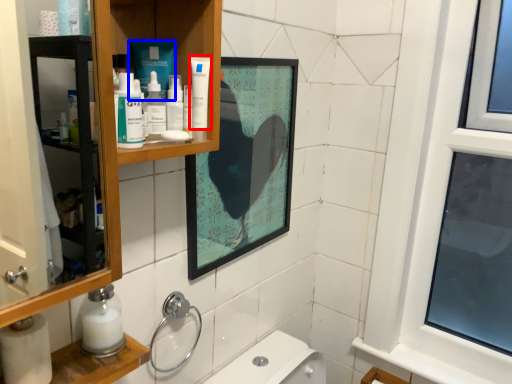
Question: Which point is closer to the camera, toothpaste (highlighted by a red box) or product (highlighted by a blue box)?

Choices:
 (A) toothpaste
 (B) product

Answer: (A)